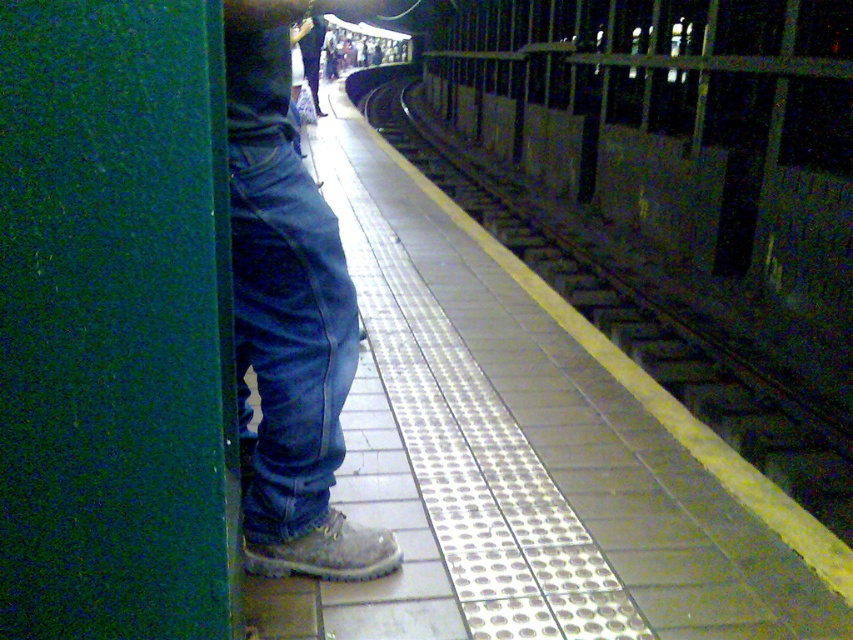
Question: Which point is farther from the camera taking this photo?

Choices:
 (A) tap(247, 284)
 (B) tap(844, 492)

Answer: (B)

Question: Can you confirm if denim jeans at center is bigger than metal/smooth train track at center?

Choices:
 (A) yes
 (B) no

Answer: (B)

Question: Which object is farther from the camera taking this photo?

Choices:
 (A) denim jeans at center
 (B) metal/smooth train track at center

Answer: (B)

Question: Which point is closer to the camera?

Choices:
 (A) denim jeans at center
 (B) metal/smooth train track at center

Answer: (A)

Question: In this image, where is denim jeans at center located relative to metal/smooth train track at center?

Choices:
 (A) left
 (B) right

Answer: (A)

Question: Does denim jeans at center have a greater width compared to metal/smooth train track at center?

Choices:
 (A) yes
 (B) no

Answer: (B)